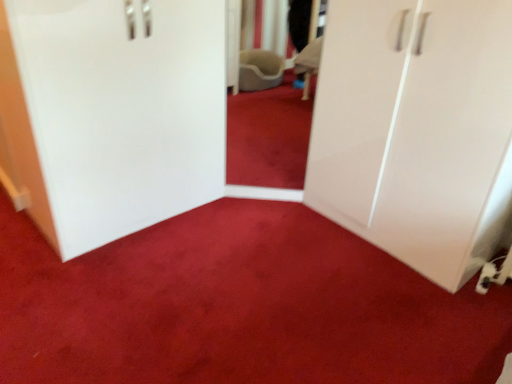
Question: Does white glossy cabinet at left have a lesser height compared to white glossy cupboard at right?

Choices:
 (A) no
 (B) yes

Answer: (B)

Question: Is white glossy cabinet at left surrounding white glossy cupboard at right?

Choices:
 (A) no
 (B) yes

Answer: (A)

Question: Is white glossy cabinet at left far from white glossy cupboard at right?

Choices:
 (A) no
 (B) yes

Answer: (B)

Question: Does white glossy cabinet at left have a smaller size compared to white glossy cupboard at right?

Choices:
 (A) no
 (B) yes

Answer: (B)

Question: Is white glossy cabinet at left not inside white glossy cupboard at right?

Choices:
 (A) no
 (B) yes

Answer: (B)

Question: From a real-world perspective, relative to white glossy cabinet at left, is white glossy cupboard at right vertically above or below?

Choices:
 (A) above
 (B) below

Answer: (A)

Question: Relative to white glossy cabinet at left, is white glossy cupboard at right in front or behind?

Choices:
 (A) behind
 (B) front

Answer: (B)

Question: Considering the positions of white glossy cupboard at right and white glossy cabinet at left in the image, is white glossy cupboard at right taller or shorter than white glossy cabinet at left?

Choices:
 (A) short
 (B) tall

Answer: (B)

Question: From the image's perspective, is white glossy cupboard at right positioned above or below white glossy cabinet at left?

Choices:
 (A) above
 (B) below

Answer: (B)

Question: From their relative heights in the image, would you say white glossy cabinet at left is taller or shorter than matte white wardrobe at center?

Choices:
 (A) tall
 (B) short

Answer: (A)

Question: Is white glossy cabinet at left bigger or smaller than matte white wardrobe at center?

Choices:
 (A) big
 (B) small

Answer: (A)

Question: Looking at their shapes, would you say white glossy cabinet at left is wider or thinner than matte white wardrobe at center?

Choices:
 (A) thin
 (B) wide

Answer: (A)

Question: Choose the correct answer: Is white glossy cabinet at left inside matte white wardrobe at center or outside it?

Choices:
 (A) outside
 (B) inside

Answer: (A)

Question: In the image, is white glossy cabinet at left positioned in front of or behind white glossy cupboard at right?

Choices:
 (A) behind
 (B) front

Answer: (A)

Question: Considering the positions of point (98, 38) and point (376, 41), is point (98, 38) closer or farther from the camera than point (376, 41)?

Choices:
 (A) closer
 (B) farther

Answer: (A)